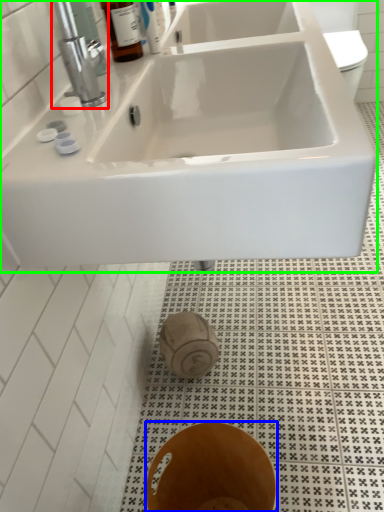
Question: Based on their relative distances, which object is nearer to tap (highlighted by a red box)? Choose from bidet (highlighted by a blue box) and sink (highlighted by a green box).

Choices:
 (A) bidet
 (B) sink

Answer: (B)